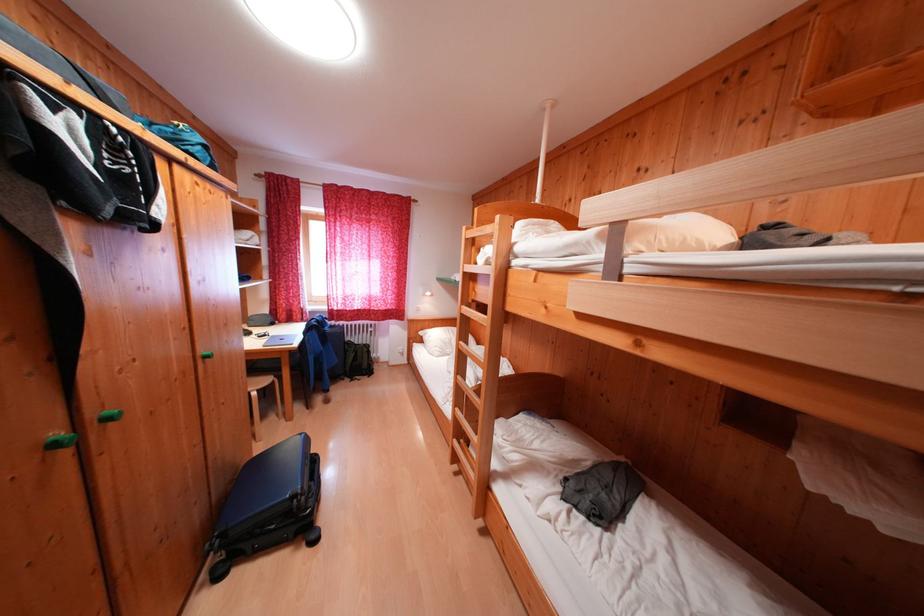
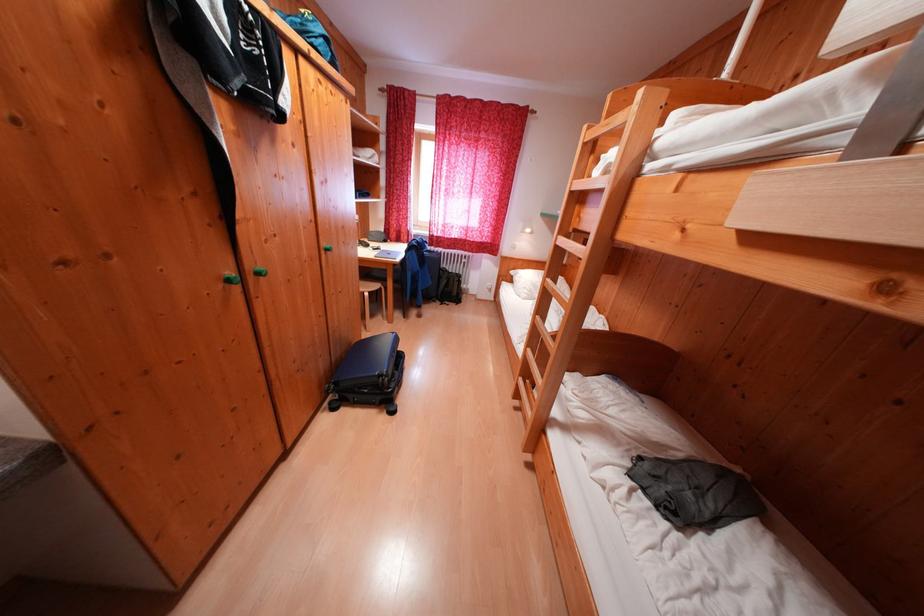
In the second image, find the point that corresponds to the point at 310,492 in the first image.

(395, 376)